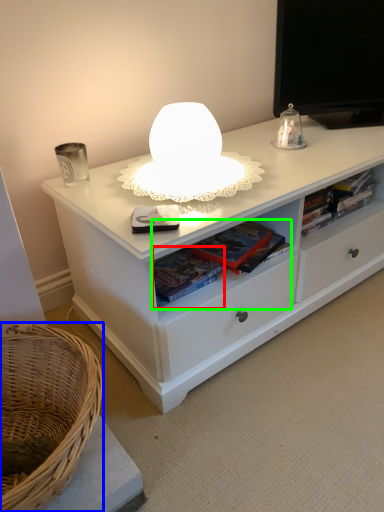
Question: Which object is the closest to the book (highlighted by a red box)? Choose among these: basket (highlighted by a blue box) or book (highlighted by a green box).

Choices:
 (A) basket
 (B) book

Answer: (B)